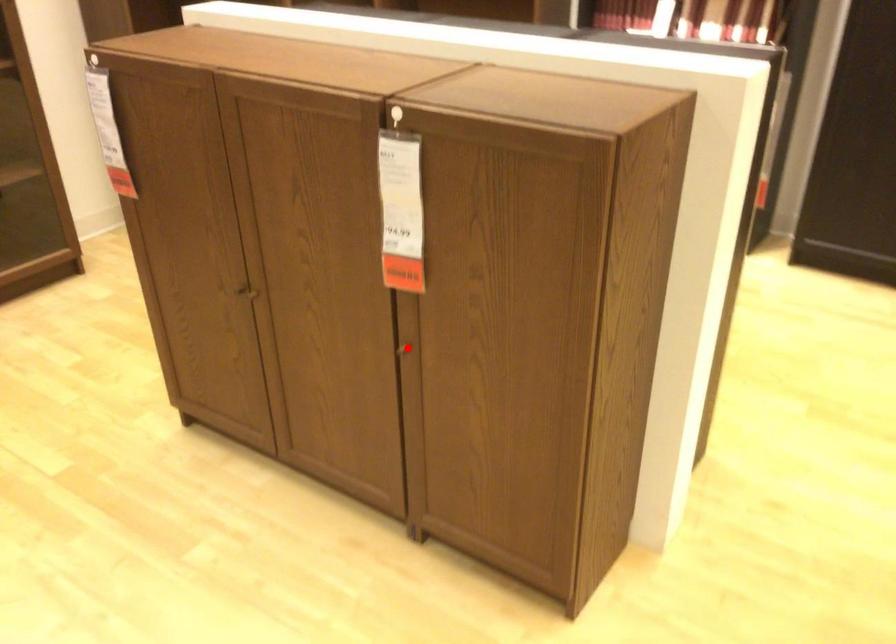
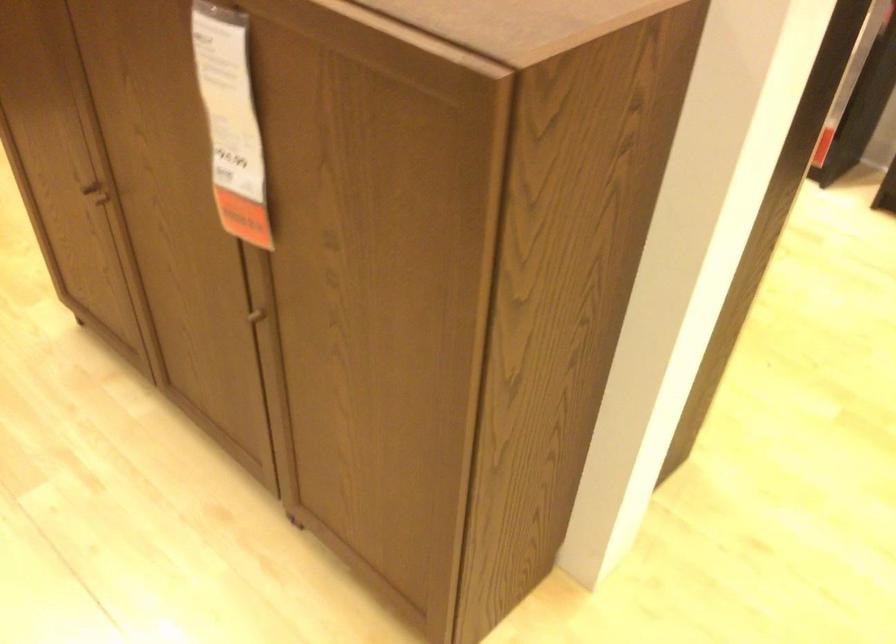
Find the pixel in the second image that matches the highlighted location in the first image.

(262, 314)